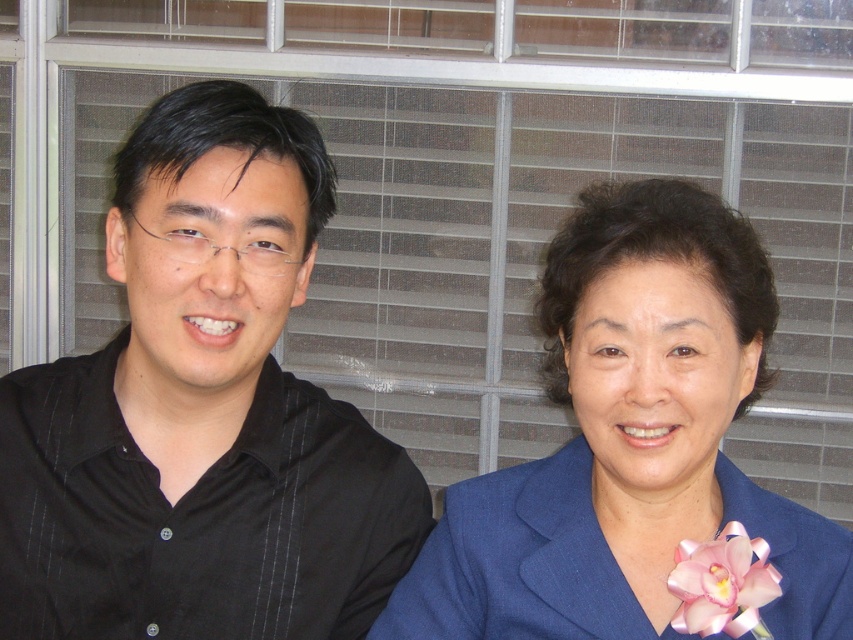
You are an interior designer assessing the placement of items in the scene. You need to determine the position of the blue fabric jacket at right relative to the window with horizontal blinds. Is the jacket closer to the window or farther away from it?

The blue fabric jacket at right is located at point (636, 454), which indicates its position relative to the window. Since the window is the backdrop, the jacket is positioned closer to the window compared to the individuals sitting against it. However, without specific coordinate references for the window, it is challenging to definitively state the exact distance. The coordinates suggest it is placed near the lower right area of the scene, but the exact proximity to the window cannot be determined with

You are a photographer setting up a shoot. You need to ensure that the blue fabric jacket at right is fully visible without being blocked by the black pinstripe shirt at left. Based on the scene, is this possible?

The blue fabric jacket at right is behind the black pinstripe shirt at left, so it might be partially blocked. To ensure full visibility, adjust their positions or angle so the blue fabric jacket at right is not obscured by the black pinstripe shirt at left.

You are an interior designer assessing the color contrast in this scene. You notice the blue fabric jacket at right and the pink satin flower at lower right. Which object has a greater vertical height in the image?

The blue fabric jacket at right is taller than the pink satin flower at lower right, so the blue fabric jacket at right has a greater vertical height in the image.